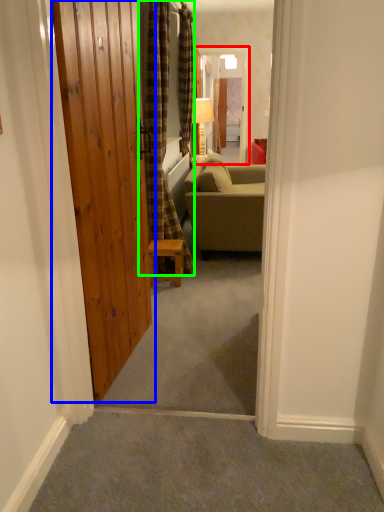
Question: Estimate the real-world distances between objects in this image. Which object is closer to screen door (highlighted by a red box), door (highlighted by a blue box) or curtain (highlighted by a green box)?

Choices:
 (A) door
 (B) curtain

Answer: (B)